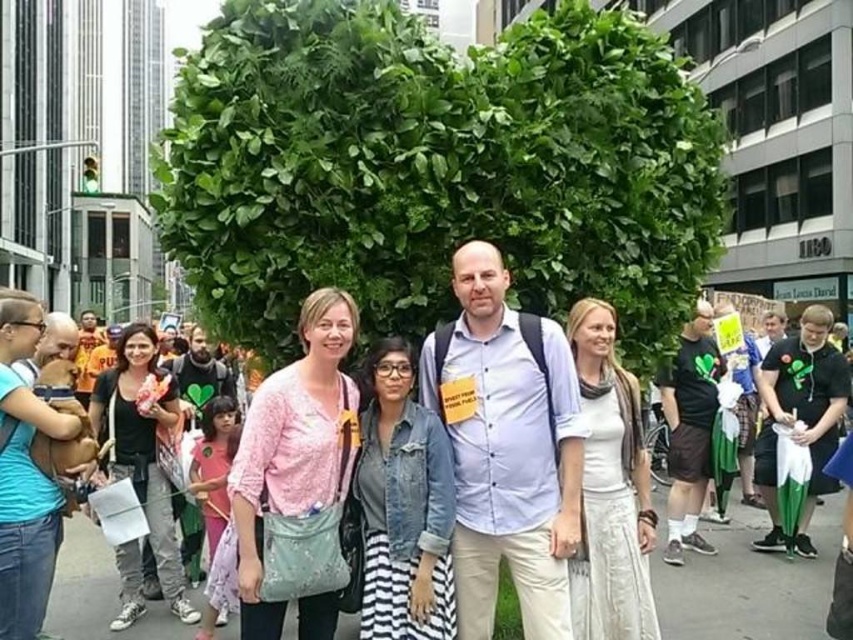
Question: Is green leafy tree at center below light blue button-down shirt at center?

Choices:
 (A) yes
 (B) no

Answer: (B)

Question: Is the position of green leafy tree at center less distant than that of light blue button-down shirt at center?

Choices:
 (A) yes
 (B) no

Answer: (B)

Question: Based on their relative distances, which object is nearer to the pink fabric shirt at center?

Choices:
 (A) light blue button-down shirt at center
 (B) green leafy tree at center
 (C) gray asphalt at lower center

Answer: (A)

Question: Does light blue button-down shirt at center have a larger size compared to gray asphalt at lower center?

Choices:
 (A) yes
 (B) no

Answer: (A)

Question: Among these objects, which one is nearest to the camera?

Choices:
 (A) light blue button-down shirt at center
 (B) pink fabric shirt at center

Answer: (A)

Question: Which object is the closest to the green leafy tree at center?

Choices:
 (A) gray asphalt at lower center
 (B) light blue button-down shirt at center

Answer: (B)